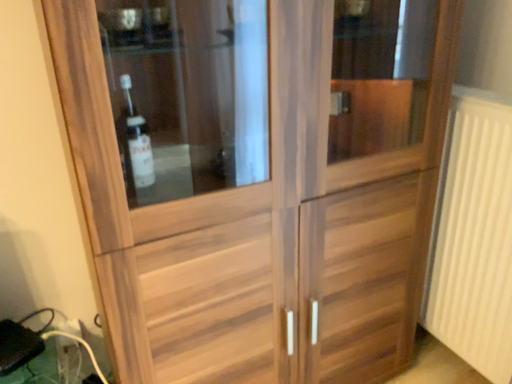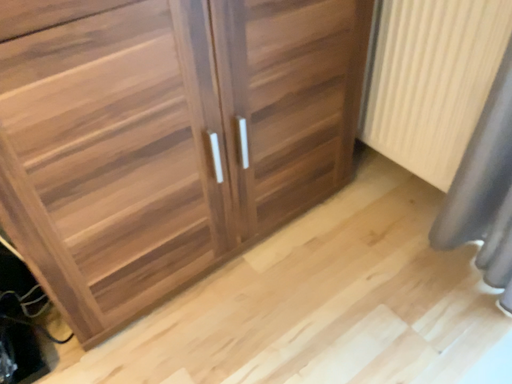
Question: Which way did the camera rotate in the video?

Choices:
 (A) rotated upward
 (B) rotated downward

Answer: (B)